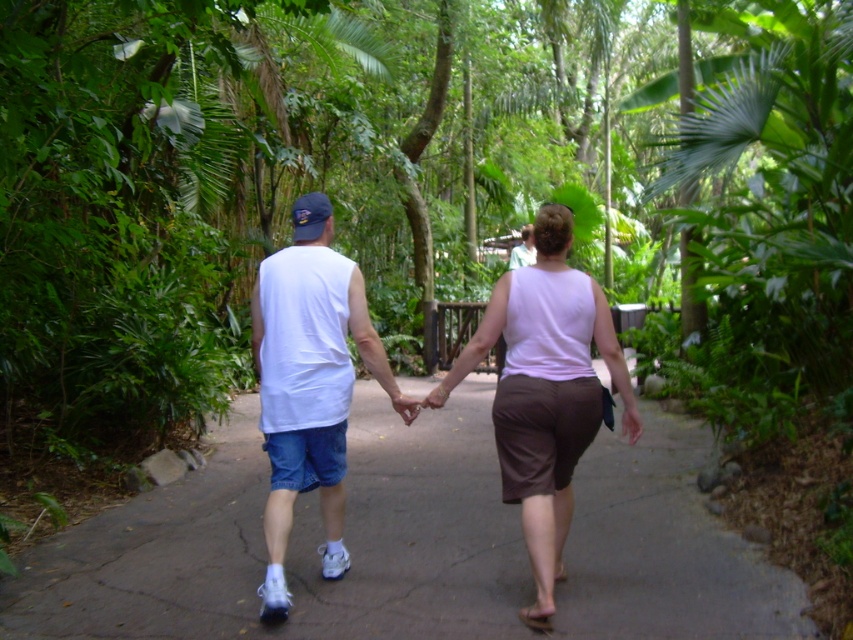
Is gray concrete pavement at center below white matte tank top at center?

Correct, gray concrete pavement at center is located below white matte tank top at center.

Does point (229, 493) come behind point (496, 392)?

Yes, it is behind point (496, 392).

In order to click on gray concrete pavement at center in this screenshot , I will do `click(299, 541)`.

Image resolution: width=853 pixels, height=640 pixels. I want to click on white matte tank top at center, so click(x=544, y=392).

Does white matte tank top at center have a larger size compared to white cotton tank top at center?

Yes.

What are the coordinates of `white matte tank top at center` in the screenshot? It's located at (544, 392).

Is point (279, 518) more distant than point (531, 253)?

No, (279, 518) is closer to viewer.

Which is more to the right, white cotton tank top at center or light green fabric shirt at center?

light green fabric shirt at center

Does point (299, 301) lie in front of point (517, 244)?

That is True.

Find the location of `white cotton tank top at center`. white cotton tank top at center is located at coordinates (309, 385).